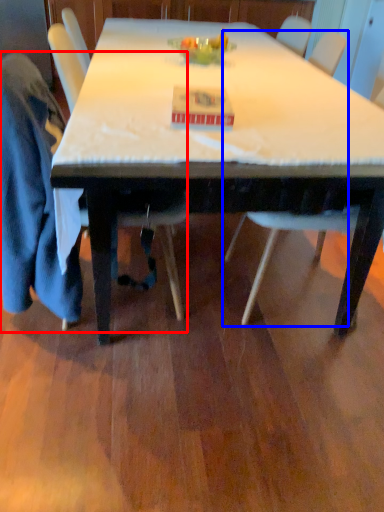
Question: Among these objects, which one is nearest to the camera, chair (highlighted by a red box) or chair (highlighted by a blue box)?

Choices:
 (A) chair
 (B) chair

Answer: (A)